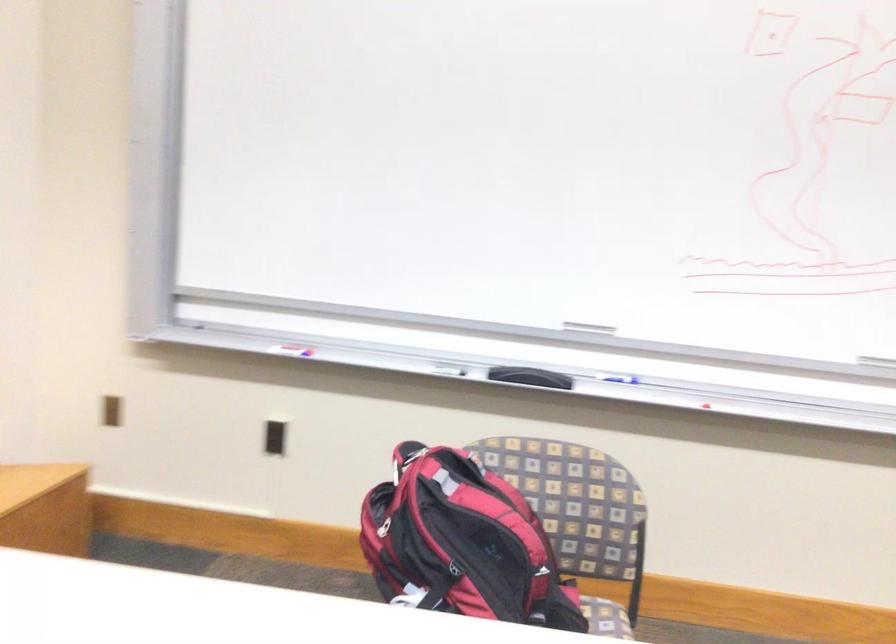
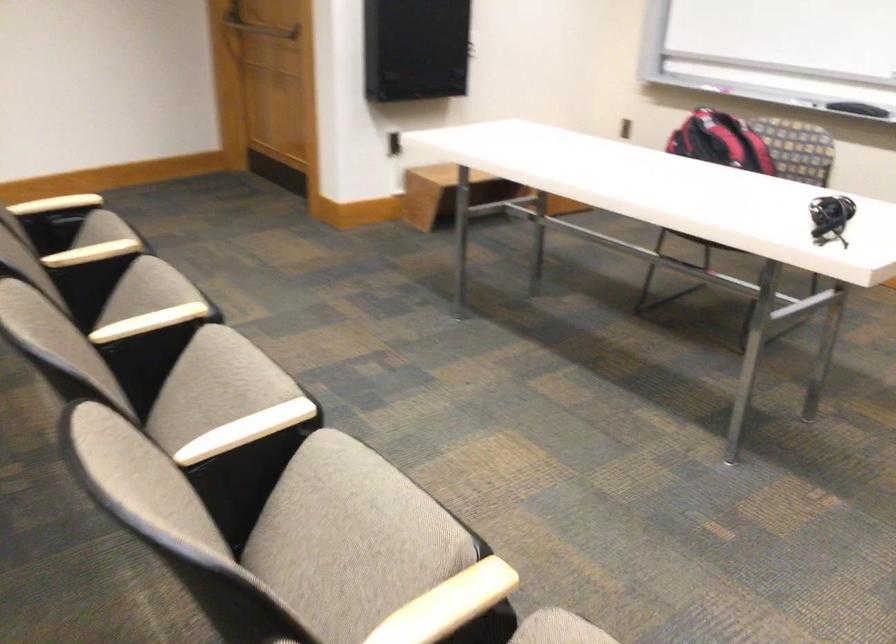
Find the pixel in the second image that matches (x=498, y=543) in the first image.

(720, 142)